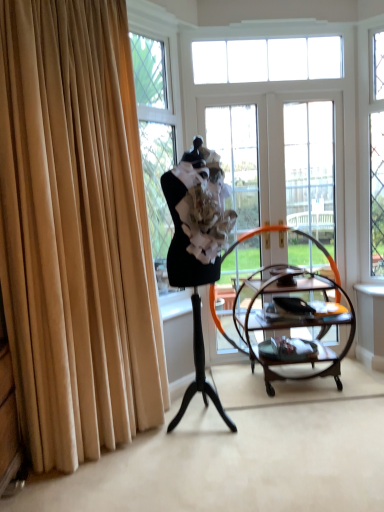
Question: Are black matte mannequin at center and clear glass window at upper center far apart?

Choices:
 (A) yes
 (B) no

Answer: (A)

Question: Could you tell me if black matte mannequin at center is turned towards clear glass window at upper center?

Choices:
 (A) yes
 (B) no

Answer: (B)

Question: Is black matte mannequin at center facing away from clear glass window at upper center?

Choices:
 (A) no
 (B) yes

Answer: (A)

Question: Does black matte mannequin at center come behind clear glass window at upper center?

Choices:
 (A) no
 (B) yes

Answer: (A)

Question: From the image's perspective, would you say black matte mannequin at center is positioned over clear glass window at upper center?

Choices:
 (A) yes
 (B) no

Answer: (B)

Question: In the image, is clear glass door at center, the second glass door from the left, positioned in front of or behind black matte mannequin at center?

Choices:
 (A) front
 (B) behind

Answer: (B)

Question: Considering the positions of clear glass door at center, arranged as the first glass door when viewed from the right, and black matte mannequin at center in the image, is clear glass door at center, arranged as the first glass door when viewed from the right, bigger or smaller than black matte mannequin at center?

Choices:
 (A) small
 (B) big

Answer: (A)

Question: In terms of width, does clear glass door at center, the second glass door from the left, look wider or thinner when compared to black matte mannequin at center?

Choices:
 (A) thin
 (B) wide

Answer: (A)

Question: Is clear glass door at center, arranged as the first glass door when viewed from the right, spatially inside black matte mannequin at center, or outside of it?

Choices:
 (A) outside
 (B) inside

Answer: (A)

Question: Considering the positions of clear glass door at center, acting as the 1th glass door starting from the left, and black matte mannequin at center in the image, is clear glass door at center, acting as the 1th glass door starting from the left, taller or shorter than black matte mannequin at center?

Choices:
 (A) short
 (B) tall

Answer: (B)

Question: Is clear glass door at center, acting as the 1th glass door starting from the left, spatially inside black matte mannequin at center, or outside of it?

Choices:
 (A) outside
 (B) inside

Answer: (A)

Question: In the image, is clear glass door at center, which is the second glass door from right to left, positioned in front of or behind black matte mannequin at center?

Choices:
 (A) front
 (B) behind

Answer: (B)

Question: In the image, is clear glass door at center, acting as the 1th glass door starting from the left, on the left side or the right side of black matte mannequin at center?

Choices:
 (A) right
 (B) left

Answer: (A)

Question: In terms of size, does clear glass door at center, arranged as the first glass door when viewed from the right, appear bigger or smaller than mahogany wood serving cart at center?

Choices:
 (A) small
 (B) big

Answer: (A)

Question: From the image's perspective, is clear glass door at center, arranged as the first glass door when viewed from the right, located above or below mahogany wood serving cart at center?

Choices:
 (A) above
 (B) below

Answer: (A)